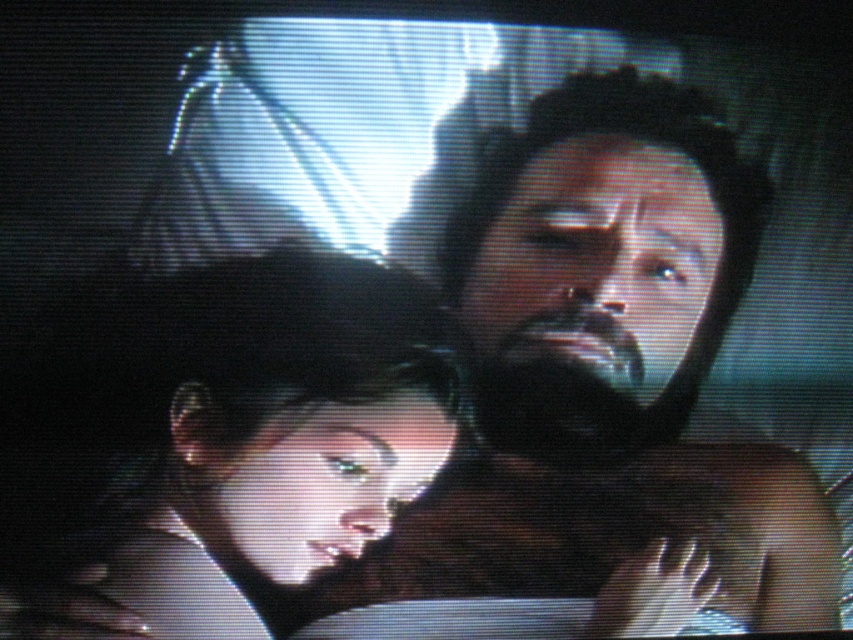
Question: Is dark brown hair at center further to the viewer compared to smooth skin face at center?

Choices:
 (A) yes
 (B) no

Answer: (B)

Question: Which point is farther from the camera taking this photo?

Choices:
 (A) (239, 442)
 (B) (735, 252)

Answer: (B)

Question: Can you confirm if dark brown hair at center is positioned to the right of smooth skin face at center?

Choices:
 (A) no
 (B) yes

Answer: (B)

Question: Where is dark brown hair at center located in relation to smooth skin face at center in the image?

Choices:
 (A) right
 (B) left

Answer: (A)

Question: Which of the following is the farthest from the observer?

Choices:
 (A) dark brown hair at center
 (B) smooth skin face at center

Answer: (B)